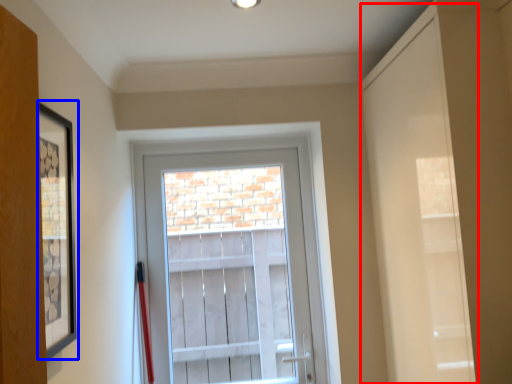
Question: Which object is closer to the camera taking this photo, door (highlighted by a red box) or picture frame (highlighted by a blue box)?

Choices:
 (A) door
 (B) picture frame

Answer: (B)